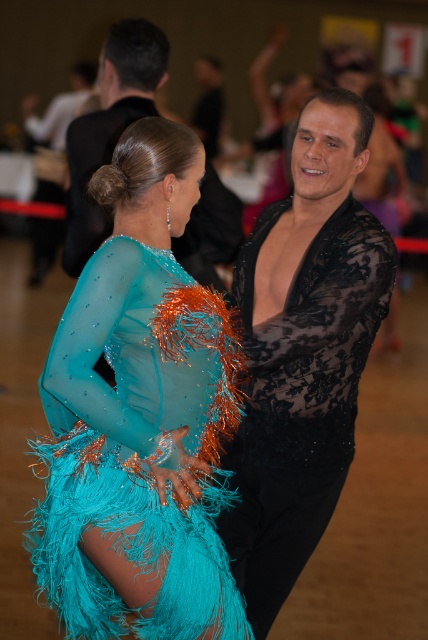
Measure the distance between turquoise sheer dress at center and black lace shirt at upper center.

The distance of turquoise sheer dress at center from black lace shirt at upper center is 1.22 meters.

I want to click on turquoise sheer dress at center, so click(x=139, y=417).

In the scene shown: Is turquoise sheer dress at center above black lace shirt at center?

Actually, turquoise sheer dress at center is below black lace shirt at center.

From the picture: Does turquoise sheer dress at center have a greater height compared to black lace shirt at center?

Incorrect, turquoise sheer dress at center's height is not larger of black lace shirt at center's.

Is point (68, 321) positioned in front of point (275, 417)?

Yes, point (68, 321) is closer to viewer.

Where is `turquoise sheer dress at center`? turquoise sheer dress at center is located at coordinates (139, 417).

Is black lace shirt at center thinner than black lace shirt at upper center?

In fact, black lace shirt at center might be wider than black lace shirt at upper center.

Is point (344, 396) positioned behind point (101, 132)?

No, (344, 396) is in front of (101, 132).

Where is `black lace shirt at center`? The height and width of the screenshot is (640, 428). black lace shirt at center is located at coordinates (303, 352).